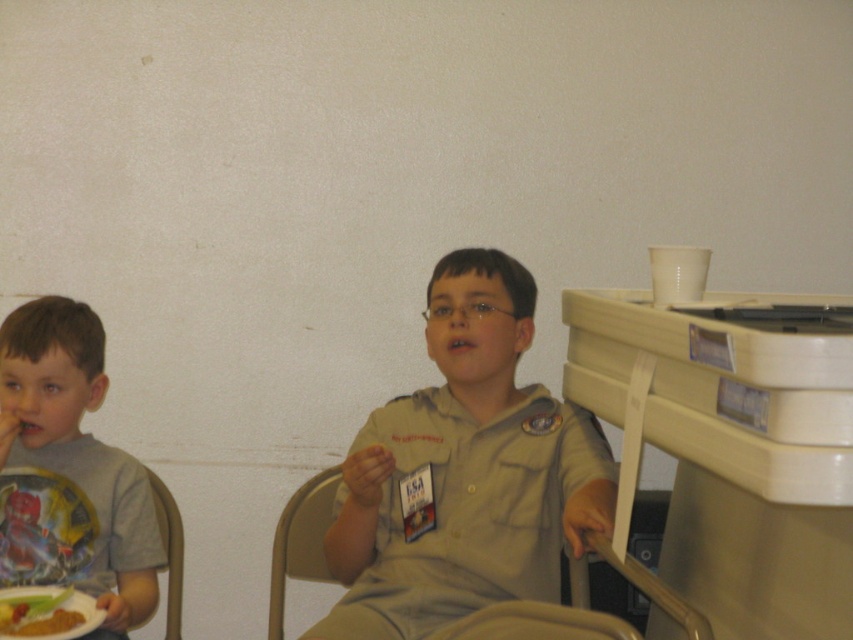
Which is in front, point (676, 529) or point (318, 525)?

Positioned in front is point (676, 529).

Between white plastic table at right and metallic gray chair at center, which one has more height?

white plastic table at right

Between point (766, 634) and point (299, 492), which one is positioned behind?

Positioned behind is point (299, 492).

Locate an element on the screen. The image size is (853, 640). white plastic table at right is located at coordinates (733, 445).

Does point (38, 464) lie behind point (308, 483)?

No, (38, 464) is in front of (308, 483).

Does gray cotton shirt at left appear on the right side of metallic gray chair at center?

In fact, gray cotton shirt at left is to the left of metallic gray chair at center.

Describe the element at coordinates (68, 470) in the screenshot. This screenshot has height=640, width=853. I see `gray cotton shirt at left` at that location.

This screenshot has width=853, height=640. Identify the location of gray cotton shirt at left. (68, 470).

Who is lower down, khaki uniform shirt at center or metallic gray chair at center?

metallic gray chair at center is lower down.

The image size is (853, 640). In order to click on khaki uniform shirt at center in this screenshot , I will do `click(465, 472)`.